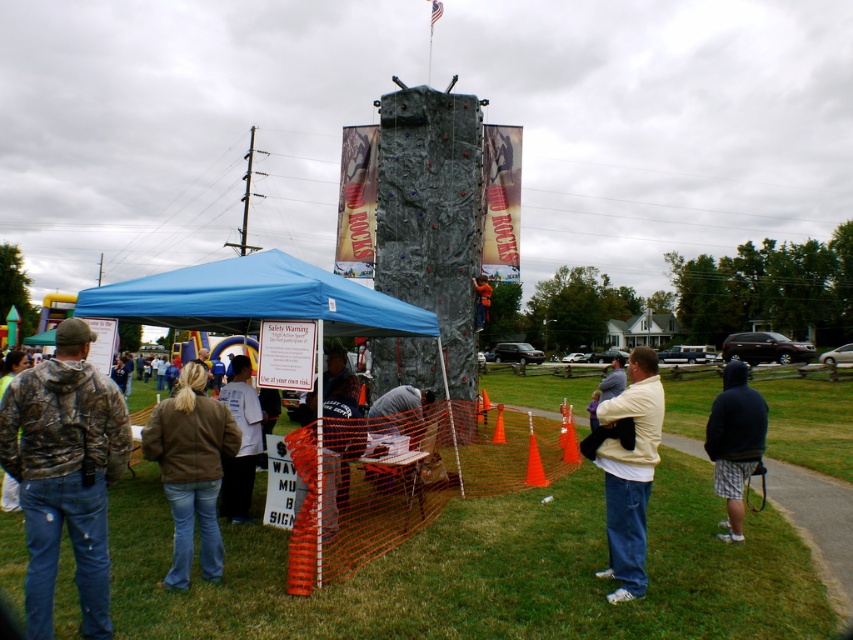
Is point (161, 413) positioned after point (732, 406)?

No, it is not.

Which is more to the left, brown leather jacket at lower left or dark blue hoodie at center?

brown leather jacket at lower left is more to the left.

Between point (212, 419) and point (741, 371), which one is positioned behind?

The point (741, 371) is more distant.

This screenshot has height=640, width=853. What are the coordinates of `brown leather jacket at lower left` in the screenshot? It's located at (190, 468).

Which is more to the left, beige cotton jacket at lower right or white cotton shirt at center?

white cotton shirt at center

Measure the distance between point (647,364) and camera.

Point (647,364) and camera are 17.95 feet apart from each other.

Who is more distant from viewer, [608,529] or [224,508]?

The point [224,508] is more distant.

Locate an element on the screen. The height and width of the screenshot is (640, 853). beige cotton jacket at lower right is located at coordinates (630, 472).

Between point (231, 515) and point (485, 284), which one is positioned behind?

Positioned behind is point (485, 284).

Which is behind, point (248, 412) or point (485, 316)?

The point (485, 316) is more distant.

Identify the location of white cotton shirt at center. The height and width of the screenshot is (640, 853). (241, 442).